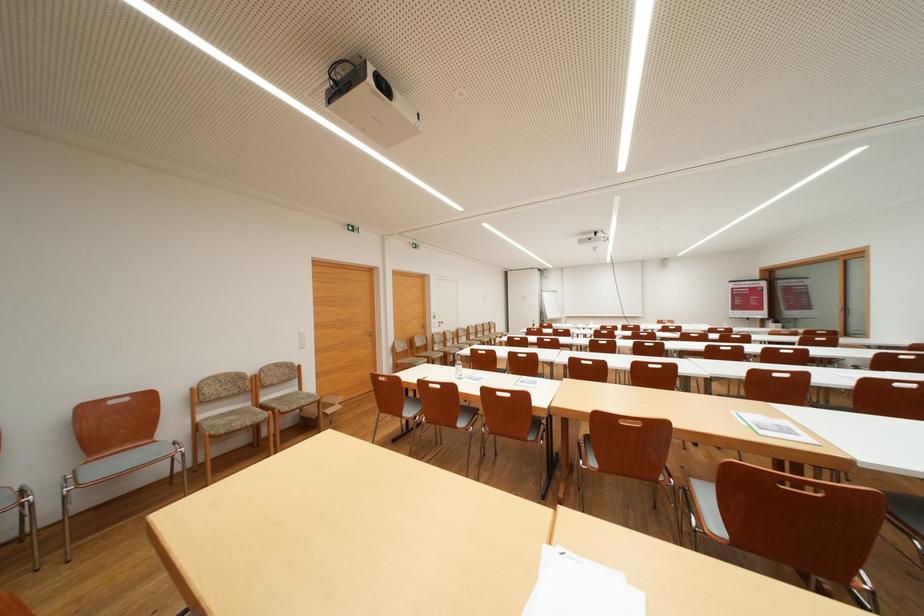
Image resolution: width=924 pixels, height=616 pixels. Describe the element at coordinates (580, 588) in the screenshot. I see `the white paper document` at that location.